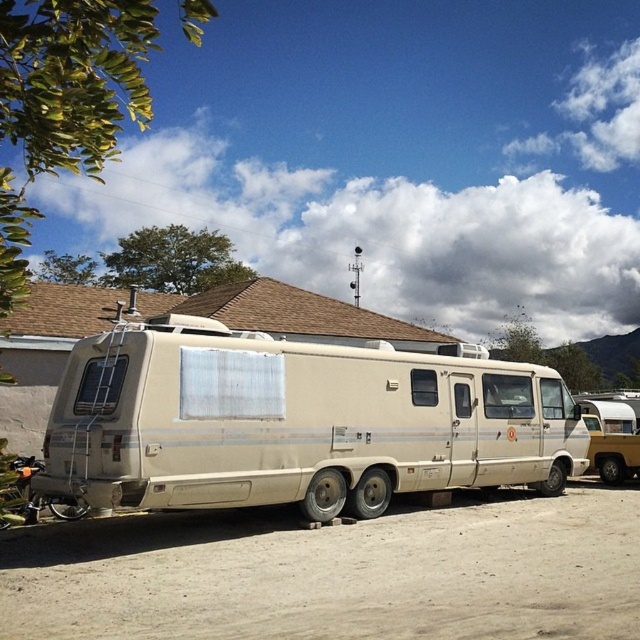
Between beige matte van at center and dirt sand at lower center, which one is positioned higher?

Positioned higher is beige matte van at center.

From the picture: Which is more to the right, beige matte van at center or dirt sand at lower center?

Positioned to the right is dirt sand at lower center.

Is point (307, 432) behind point (483, 616)?

Yes.

Where is `beige matte van at center`? Image resolution: width=640 pixels, height=640 pixels. beige matte van at center is located at coordinates (x=296, y=420).